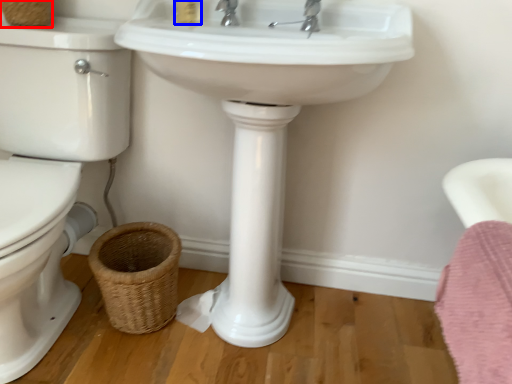
Question: Among these objects, which one is nearest to the camera, basket (highlighted by a red box) or toiletry (highlighted by a blue box)?

Choices:
 (A) basket
 (B) toiletry

Answer: (B)